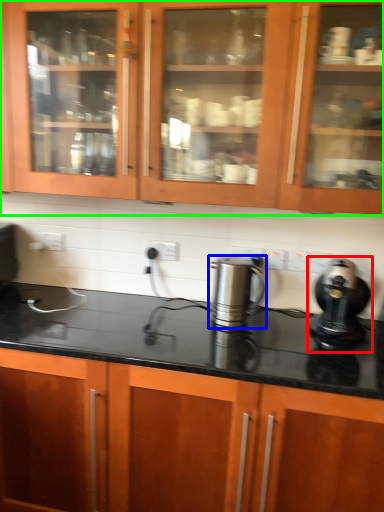
Question: Based on their relative distances, which object is nearer to home appliance (highlighted by a red box)? Choose from kitchen appliance (highlighted by a blue box) and cabinetry (highlighted by a green box).

Choices:
 (A) kitchen appliance
 (B) cabinetry

Answer: (A)